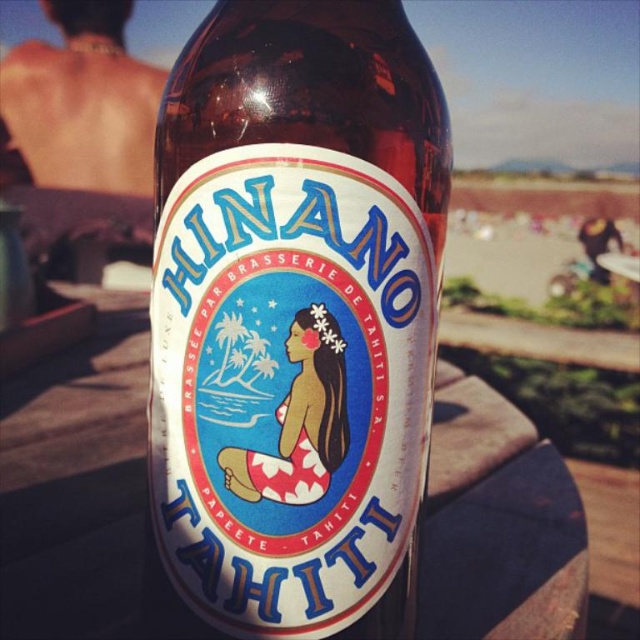
You are looking at the Hinano beer bottle and want to touch the point that is closer to you. Which point should you choose between point (x=328, y=552) and point (x=108, y=20)?

You should choose point (x=328, y=552) because it is closer to the camera than point (x=108, y=20).

You are a delivery person who needs to place the translucent glass bottle at center and the skinny tan skin at upper left into a box. The box has a maximum length of 36 inches. Can both items fit in the box without overlapping?

The distance between the translucent glass bottle at center and the skinny tan skin at upper left is 32.83 inches. Since the box can accommodate up to 36 inches, there is enough space to fit both items without overlapping.